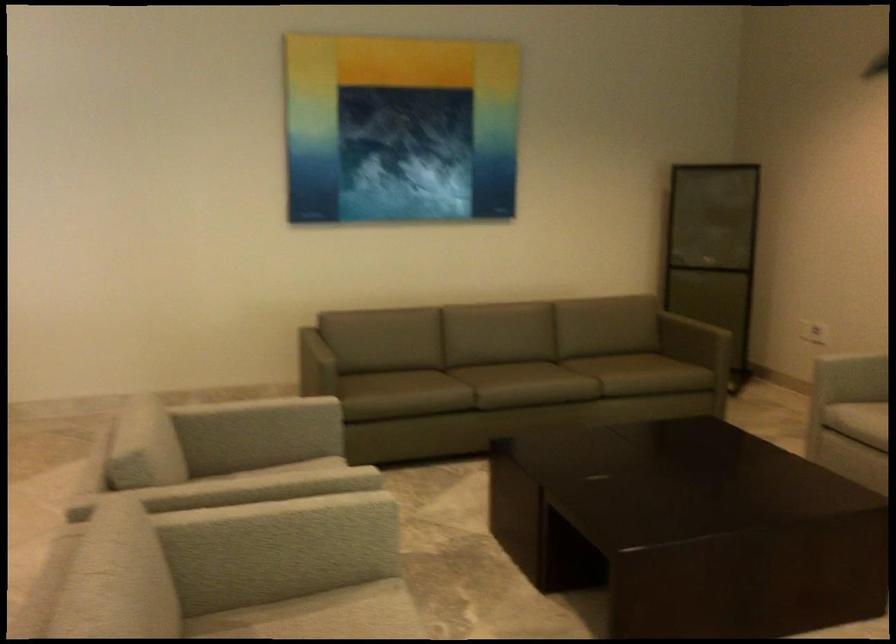
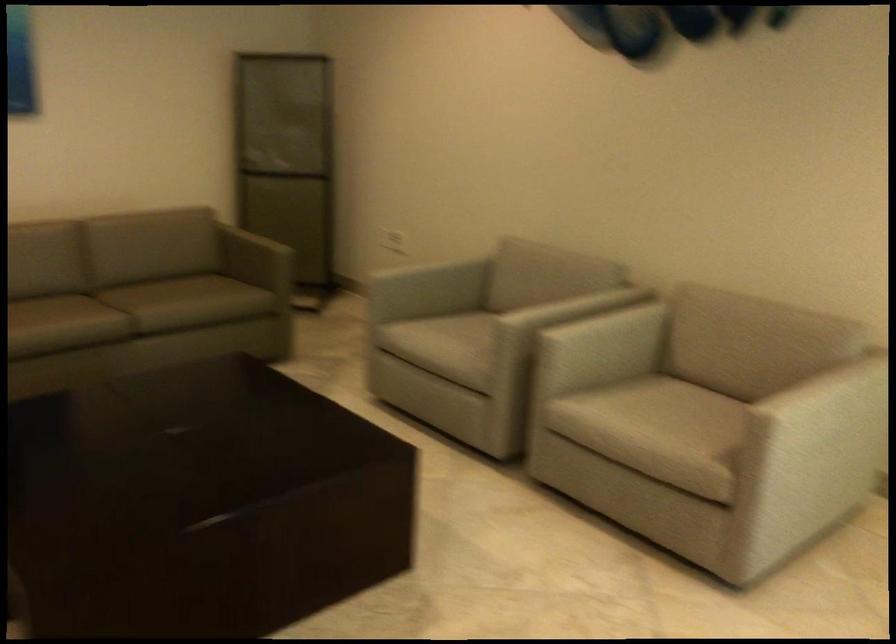
Question: The camera is either moving clockwise (left) or counter-clockwise (right) around the object. The first image is from the beginning of the video and the second image is from the end. Is the camera moving left or right when shooting the video?

Choices:
 (A) Left
 (B) Right

Answer: (A)